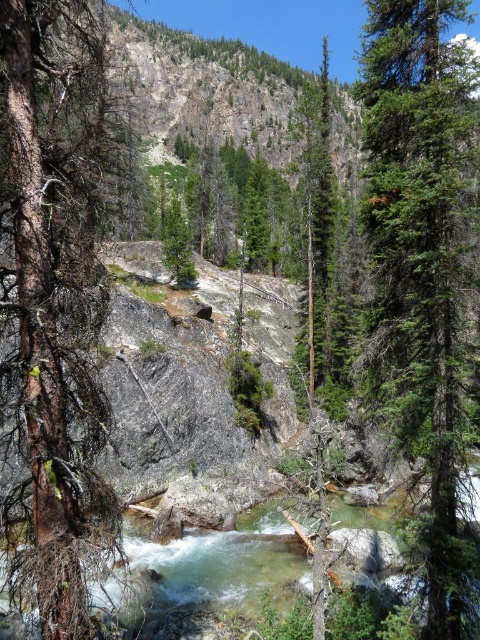
Based on the photo, you are a hiker who wants to cross the river at the center. You see the clear water at center and the green matte tree at center. Which object is directly above the other?

The green matte tree at center is directly above the clear water at center because the clear water at center is positioned under the green matte tree at center.

You are a hiker standing in the middle of the rocky riverbed. You see the clear water at center and the green matte tree at center. Which object is located to the right when facing the scene?

The clear water at center is positioned on the right side of green matte tree at center, so when facing the scene, the clear water at center is to the right of the green matte tree at center.

Consider the image. You are standing at the edge of the river in the image and notice a specific point marked at coordinates point (316, 225). Based on the scene description, can you determine what object this point is located on?

The point (316, 225) is located on the green textured tree at center.